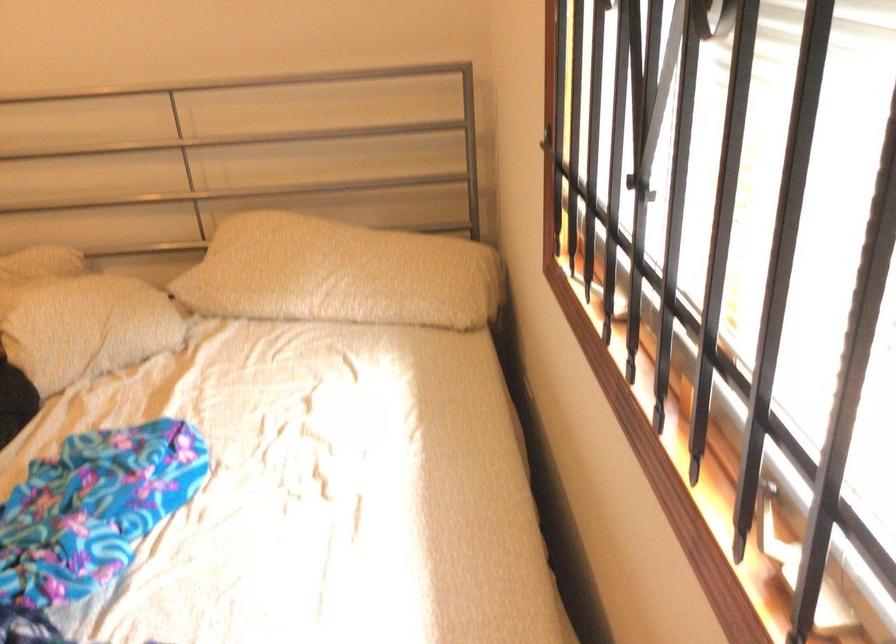
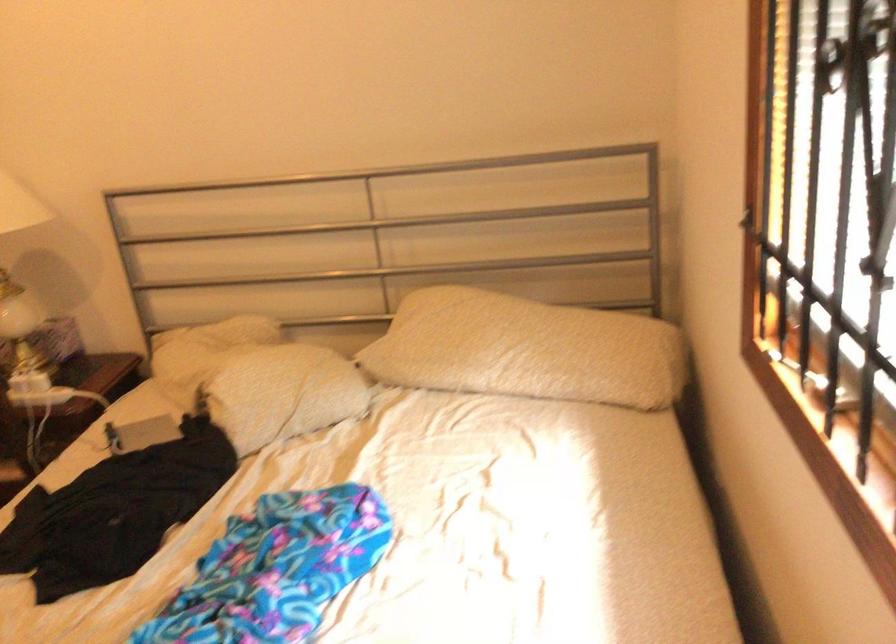
Question: Which direction would the cameraman need to move to produce the second image? Reply with the corresponding letter.

Choices:
 (A) Left
 (B) Right
 (C) Forward
 (D) Backward

Answer: (A)